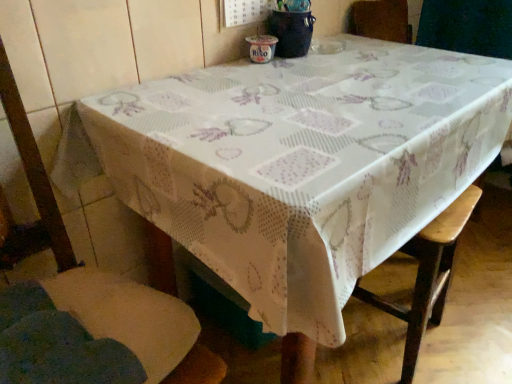
Question: Based on their positions, is wooden bar stool at lower right located to the left or right of wooden chair at lower left?

Choices:
 (A) left
 (B) right

Answer: (B)

Question: Based on their sizes in the image, would you say wooden bar stool at lower right is bigger or smaller than wooden chair at lower left?

Choices:
 (A) big
 (B) small

Answer: (B)

Question: Is wooden bar stool at lower right taller or shorter than wooden chair at lower left?

Choices:
 (A) tall
 (B) short

Answer: (B)

Question: Would you say wooden chair at lower left is inside or outside wooden bar stool at lower right?

Choices:
 (A) inside
 (B) outside

Answer: (B)

Question: From a real-world perspective, is wooden chair at lower left above or below wooden bar stool at lower right?

Choices:
 (A) below
 (B) above

Answer: (B)

Question: Considering the positions of wooden chair at lower left and wooden bar stool at lower right in the image, is wooden chair at lower left bigger or smaller than wooden bar stool at lower right?

Choices:
 (A) small
 (B) big

Answer: (B)

Question: From the image's perspective, is wooden chair at lower left located above or below wooden bar stool at lower right?

Choices:
 (A) above
 (B) below

Answer: (A)